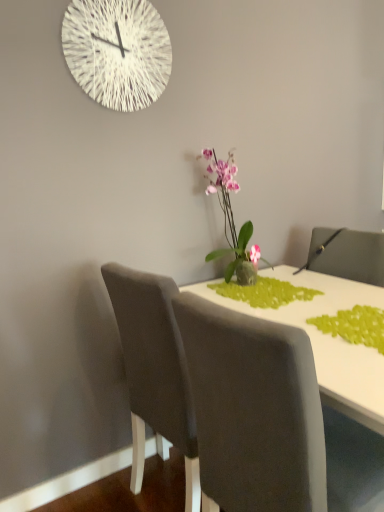
Where is `vacant space in between green matte plant at center, acting as the second plant starting from the front, and green textured placemat at lower right, the second plant from the back`? The width and height of the screenshot is (384, 512). vacant space in between green matte plant at center, acting as the second plant starting from the front, and green textured placemat at lower right, the second plant from the back is located at coordinates (315, 307).